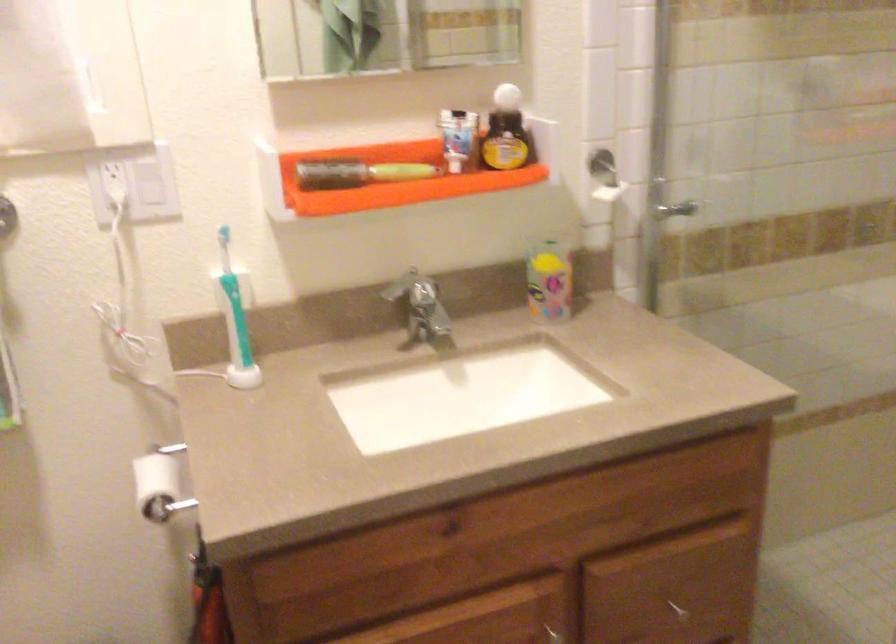
Where would you push the white light switch? Please return your answer as a coordinate pair (x, y).

(149, 183)